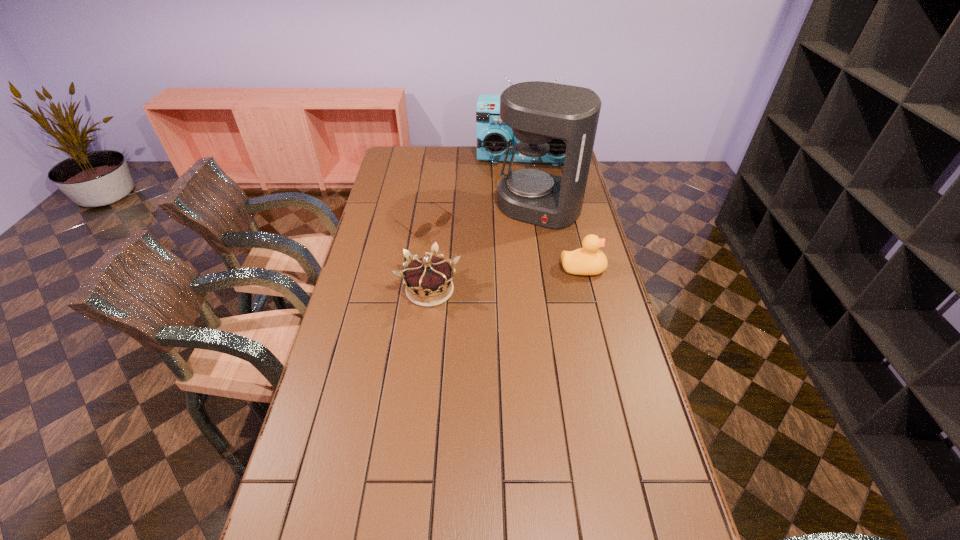
Locate an element on the screen. free space on the desktop that is between the crown and the duck and is positioned on the front-facing side of the farthest object is located at coordinates (520, 277).

At what (x,y) coordinates should I click in order to perform the action: click on vacant space on the desktop that is between the crown and the duck and is positioned on the front-facing side of the tallest object. Please return your answer as a coordinate pair (x, y). This screenshot has width=960, height=540. Looking at the image, I should click on (499, 280).

The height and width of the screenshot is (540, 960). In order to click on vacant space on the desktop that is between the crown and the duck and is positioned on the face of the shortest object in this screenshot , I will do `click(504, 279)`.